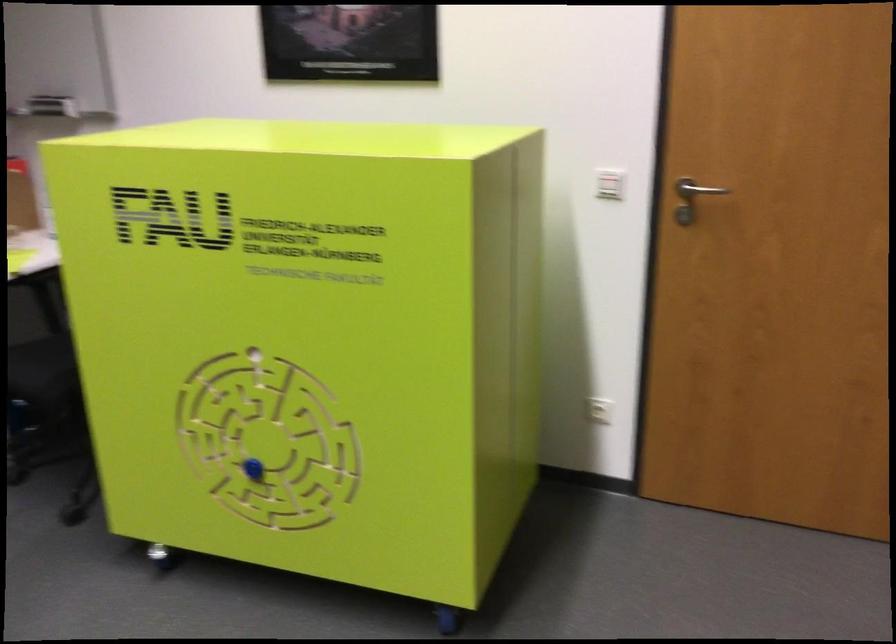
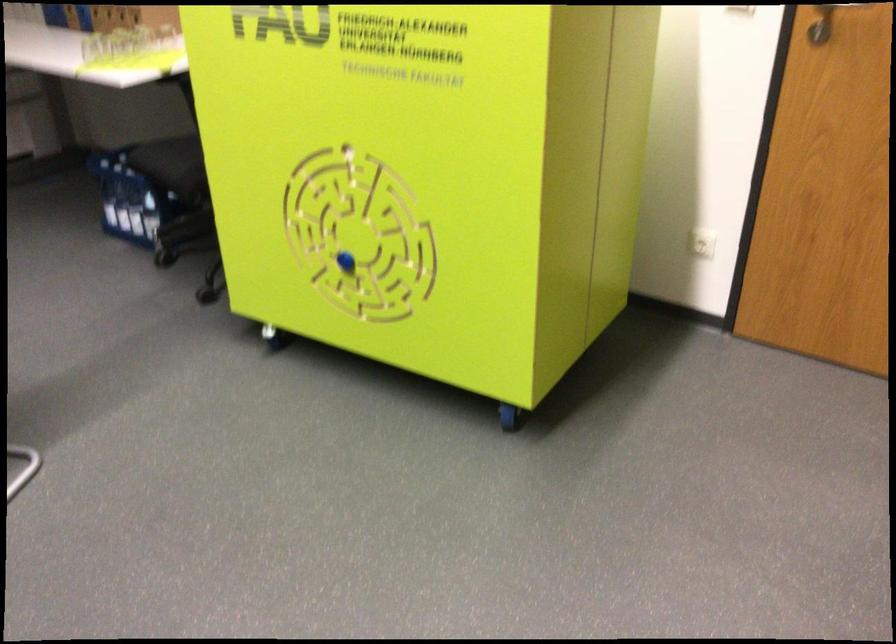
The point at (688, 202) is marked in the first image. Where is the corresponding point in the second image?

(821, 24)